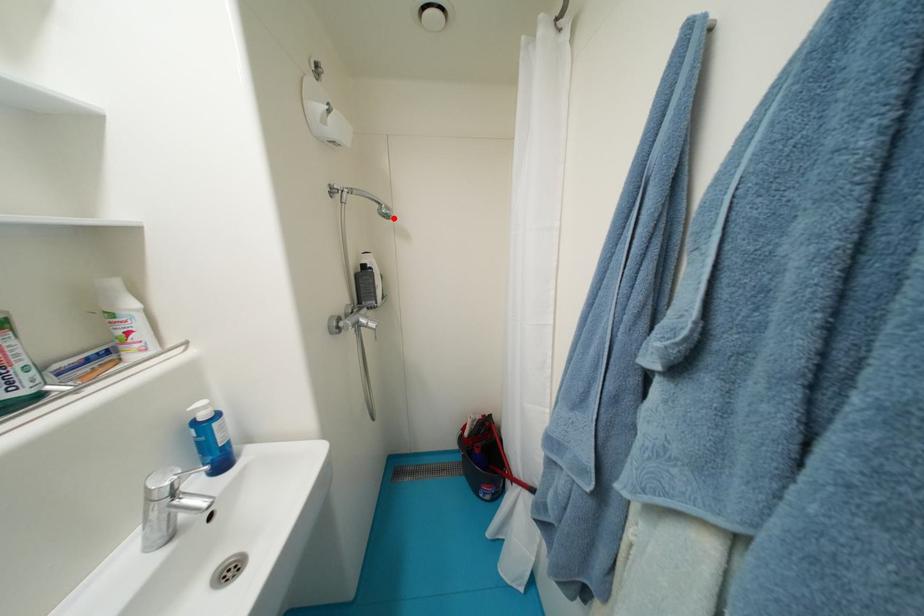
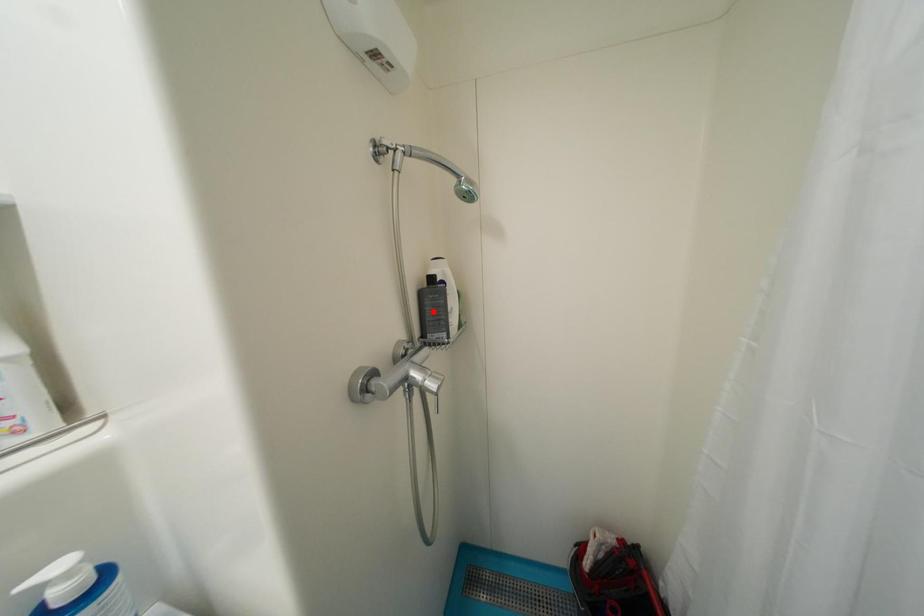
I am providing you with two images of the same scene from different viewpoints. A red point is marked on the first image and another point is marked on the second image. Do the highlighted points in image1 and image2 indicate the same real-world spot?

No